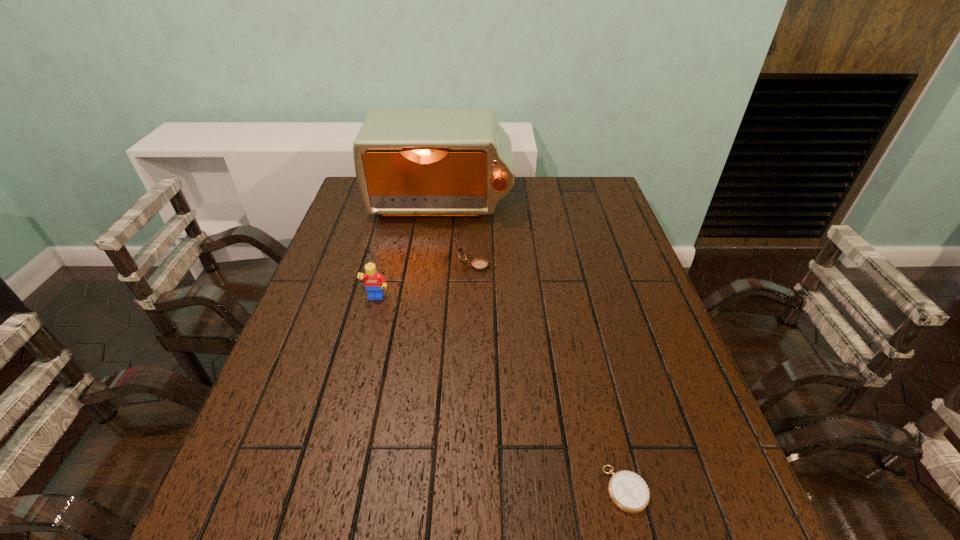
You are a GUI agent. You are given a task and a screenshot of the screen. Output one action in this format:
    pyautogui.click(x=<x>, y=<y>)
    Task: Click on the free point between the right compass and the third farthest object
    Image resolution: width=960 pixels, height=540 pixels.
    Given the screenshot: What is the action you would take?
    pyautogui.click(x=501, y=394)

Where is `object that can be found as the second closest to the second nearest object`? object that can be found as the second closest to the second nearest object is located at coordinates (458, 162).

Identify which object is the third nearest to the second farthest object. Please provide its 2D coordinates. Your answer should be formatted as a tuple, i.e. [(x, y)], where the tuple contains the x and y coordinates of a point satisfying the conditions above.

[(628, 491)]

The image size is (960, 540). I want to click on free point that satisfies the following two spatial constraints: 1. on the face of the shortest object; 2. on the left side of the farther compass, so click(474, 489).

This screenshot has width=960, height=540. In order to click on vacant position in the image that satisfies the following two spatial constraints: 1. on the face of the nearest object; 2. on the right side of the Lego in this screenshot , I will do `click(328, 489)`.

Locate an element on the screen. The width and height of the screenshot is (960, 540). vacant region that satisfies the following two spatial constraints: 1. on the face of the taller compass; 2. on the right side of the shorter compass is located at coordinates (474, 489).

The image size is (960, 540). Identify the location of free space that satisfies the following two spatial constraints: 1. on the face of the right compass; 2. on the right side of the second nearest object. (328, 489).

Where is `blank area in the image that satisfies the following two spatial constraints: 1. on the face of the nearest object; 2. on the right side of the third shortest object`? blank area in the image that satisfies the following two spatial constraints: 1. on the face of the nearest object; 2. on the right side of the third shortest object is located at coordinates (328, 489).

Identify the location of free space that satisfies the following two spatial constraints: 1. on the face of the taller compass; 2. on the face of the third farthest object. This screenshot has width=960, height=540. (476, 299).

Find the location of a particular element. Image resolution: width=960 pixels, height=540 pixels. vacant region that satisfies the following two spatial constraints: 1. on the door side of the nearest object; 2. on the left side of the tallest object is located at coordinates (405, 489).